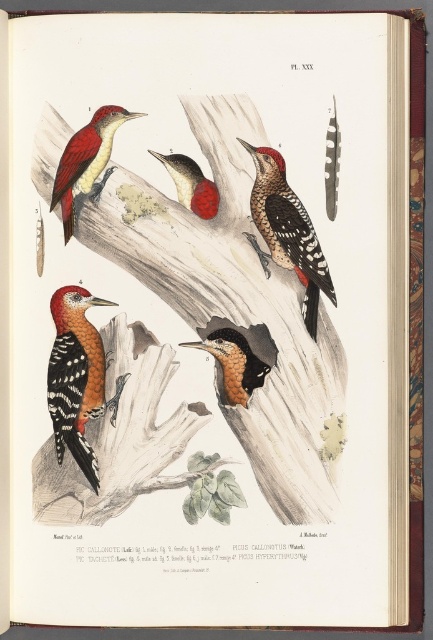
You are a naturalist comparing two woodpeckers in the illustration. The speckled brown woodpecker at center and the rustic brown woodpecker at center. Which one has a greater width?

The speckled brown woodpecker at center has a greater width than the rustic brown woodpecker at center.

You are a researcher examining the woodpecker illustrations in the book. You need to identify which woodpecker is positioned lower on the page between the speckled orange woodpecker at center and the smooth red woodpecker at center. Which one should you point out?

The speckled orange woodpecker at center is located below the smooth red woodpecker at center, so you should point out the speckled orange woodpecker at center as the lower one.